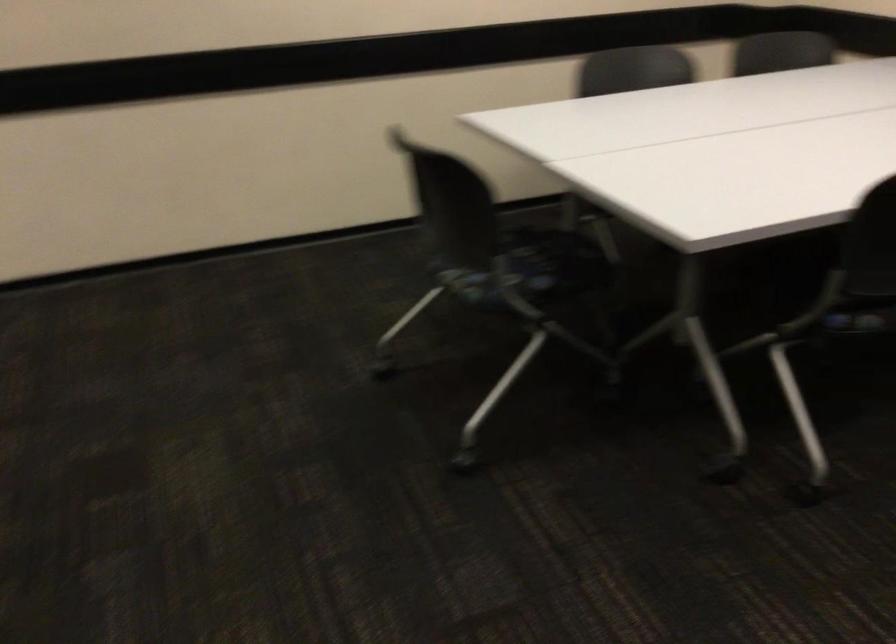
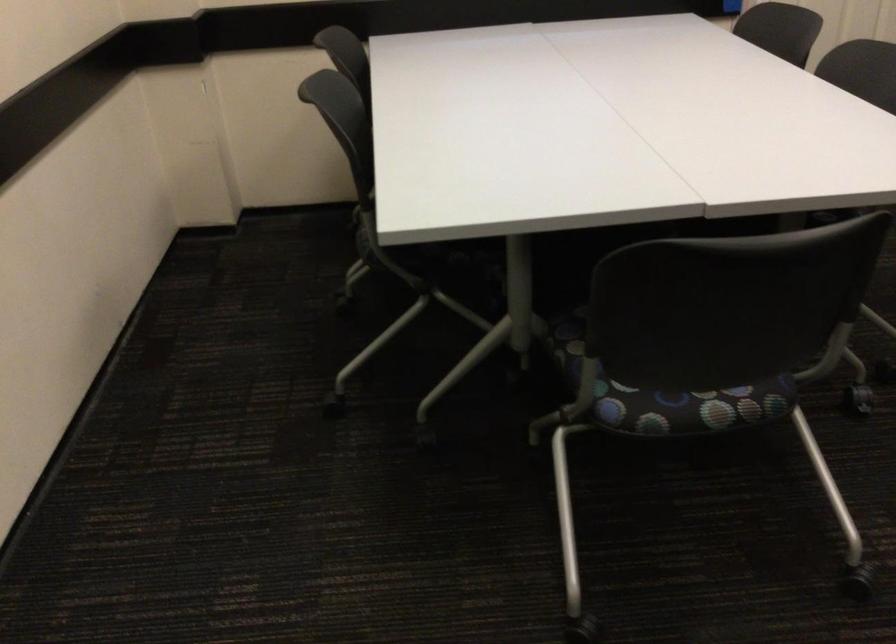
Where in the second image is the point corresponding to (467,281) from the first image?

(688, 406)